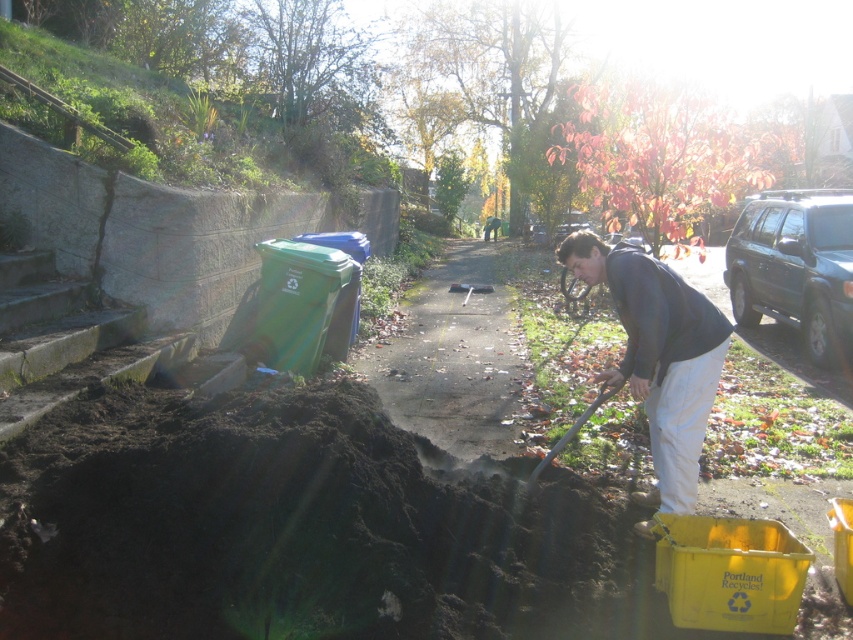
Question: Which point is closer to the camera taking this photo?

Choices:
 (A) (650, 305)
 (B) (581, 416)

Answer: (A)

Question: Is dark gray hoodie at center to the right of wooden shovel at lower center from the viewer's perspective?

Choices:
 (A) no
 (B) yes

Answer: (B)

Question: Which point is closer to the camera?

Choices:
 (A) dark gray hoodie at center
 (B) wooden shovel at lower center

Answer: (A)

Question: Which object is farther from the camera taking this photo?

Choices:
 (A) dark gray hoodie at center
 (B) wooden shovel at lower center

Answer: (B)

Question: Does dark gray hoodie at center appear on the right side of wooden shovel at lower center?

Choices:
 (A) yes
 (B) no

Answer: (A)

Question: In this image, where is dark gray hoodie at center located relative to wooden shovel at lower center?

Choices:
 (A) above
 (B) below

Answer: (A)